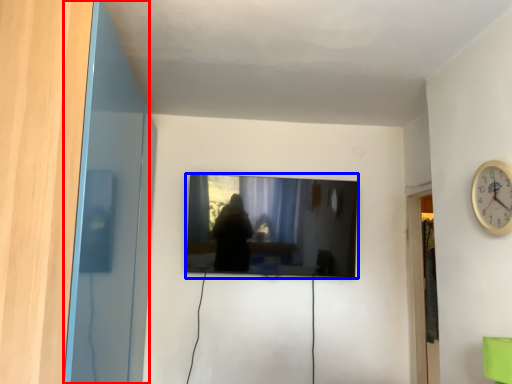
Question: Which object appears closest to the camera in this image, glass door (highlighted by a red box) or television (highlighted by a blue box)?

Choices:
 (A) glass door
 (B) television

Answer: (A)